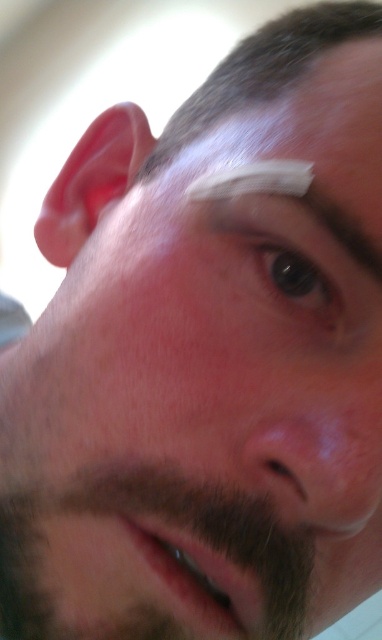
Can you confirm if dark brown fuzzy beard at lower left is taller than brown matte eye at center?

Correct, dark brown fuzzy beard at lower left is much taller as brown matte eye at center.

Can you confirm if dark brown fuzzy beard at lower left is wider than brown matte eye at center?

Correct, the width of dark brown fuzzy beard at lower left exceeds that of brown matte eye at center.

Locate an element on the screen. The height and width of the screenshot is (640, 382). dark brown fuzzy beard at lower left is located at coordinates (150, 518).

Between point (182, 118) and point (299, 262), which one is positioned behind?

The point (182, 118) is more distant.

Which is above, dark brown hair at upper center or black glossy eye at center?

Positioned higher is dark brown hair at upper center.

In the scene shown: Who is more forward, (370, 29) or (276, 256)?

Point (276, 256) is in front.

The width and height of the screenshot is (382, 640). Find the location of `dark brown hair at upper center`. dark brown hair at upper center is located at coordinates (263, 68).

Can you confirm if smooth skin nose at center is positioned above brown matte eye at center?

No.

Is smooth skin nose at center taller than brown matte eye at center?

Incorrect, smooth skin nose at center's height is not larger of brown matte eye at center's.

Measure the distance between smooth skin nose at center and camera.

smooth skin nose at center and camera are 8.36 inches apart from each other.

At what (x,y) coordinates should I click in order to perform the action: click on smooth skin nose at center. Please return your answer as a coordinate pair (x, y). This screenshot has height=640, width=382. Looking at the image, I should click on (309, 458).